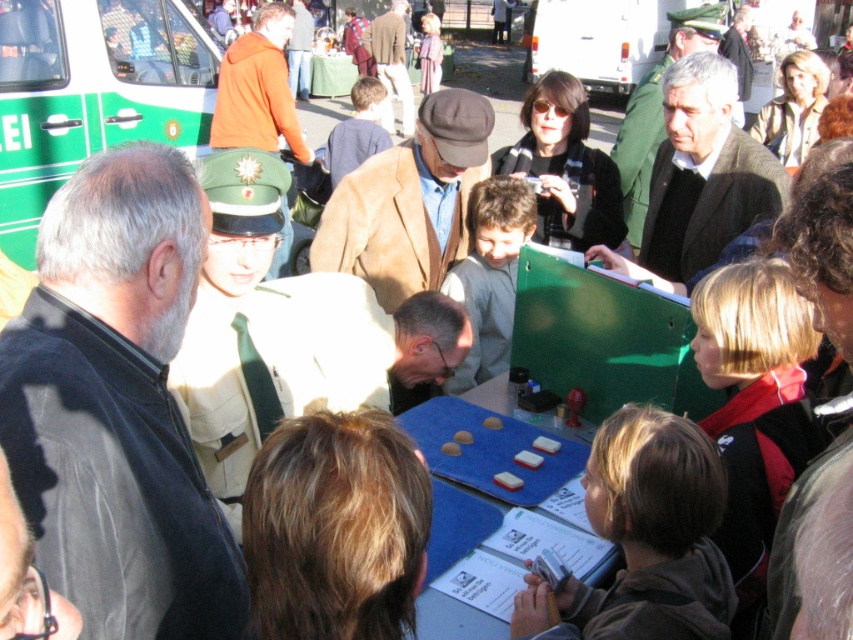
Question: Can you confirm if green matte ambulance at left is bigger than brown leather jacket at center?

Choices:
 (A) yes
 (B) no

Answer: (B)

Question: Which of the following is the farthest from the observer?

Choices:
 (A) white uniform at center
 (B) brown suede jacket at center
 (C) green matte ambulance at left
 (D) matte brown jacket at center

Answer: (C)

Question: Estimate the real-world distances between objects in this image. Which object is farther from the brown suede jacket at center?

Choices:
 (A) green matte ambulance at left
 (B) orange jacket at center

Answer: (A)

Question: Can you confirm if brown suede jacket at center is smaller than brown leather jacket at center?

Choices:
 (A) yes
 (B) no

Answer: (A)

Question: Can you confirm if white uniform at center is bigger than green matte ambulance at left?

Choices:
 (A) no
 (B) yes

Answer: (A)

Question: Which object is farther from the camera taking this photo?

Choices:
 (A) orange jacket at center
 (B) black matte jacket at left
 (C) brown suede jacket at center

Answer: (A)